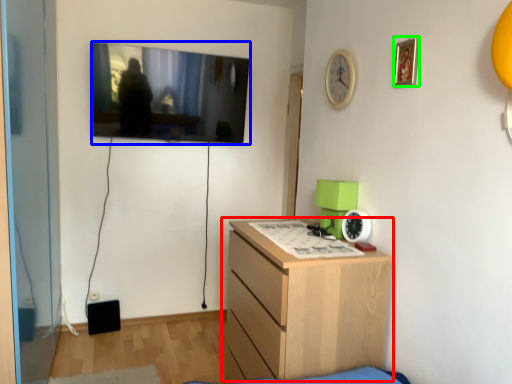
Question: Considering the real-world distances, which object is closest to chest of drawers (highlighted by a red box)? television (highlighted by a blue box) or picture frame (highlighted by a green box).

Choices:
 (A) television
 (B) picture frame

Answer: (B)